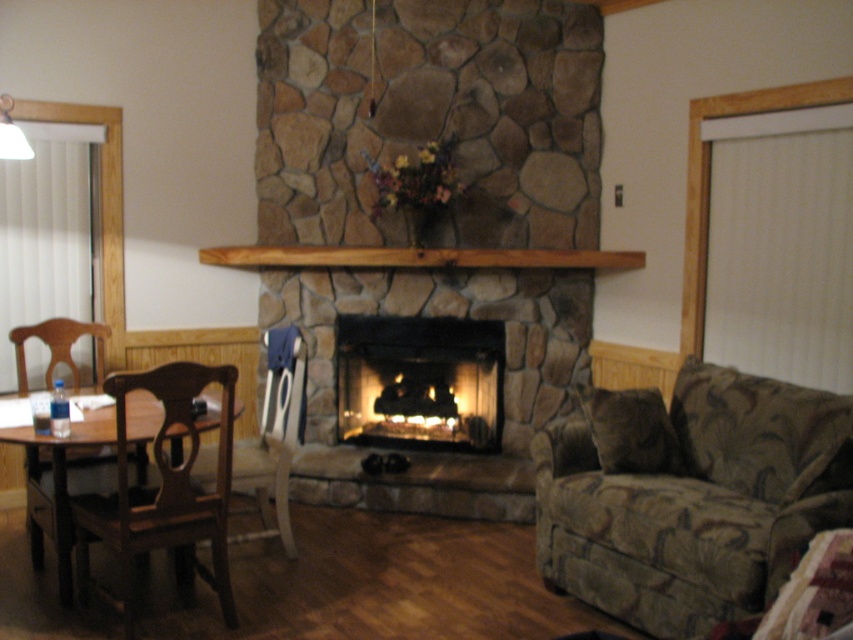
You are a person who is 1.8 meters tall. You want to sit on the brown floral fabric couch at lower right and then move to the brown fabric chair at left. Considering your height, will you be able to move freely between them without bumping your head?

The distance between the brown floral fabric couch at lower right and the brown fabric chair at left is 2.64 meters. Since your height is 1.8 meters, which is less than the distance between them, you can move freely between them without bumping your head.

You are a delivery person carrying a package that requires a clear path to the smooth stone fireplace at center. You are currently standing on the brown floral fabric couch at lower right. Is there enough space to walk directly to the fireplace?

The distance between the brown floral fabric couch at lower right and the smooth stone fireplace at center is 1.42 meters. Since the couch is furniture and you can step off it, there should be sufficient space to walk directly to the fireplace unless there are other obstacles not mentioned.

You are planning to hang a large painting on the wall behind the smooth stone fireplace at center and the velvet brown armchair at center. Which object should you avoid placing the painting too close to so it doesn

The velvet brown armchair at center is taller than the smooth stone fireplace at center. Placing the painting too close to the velvet brown armchair at center may block the view from the chair.